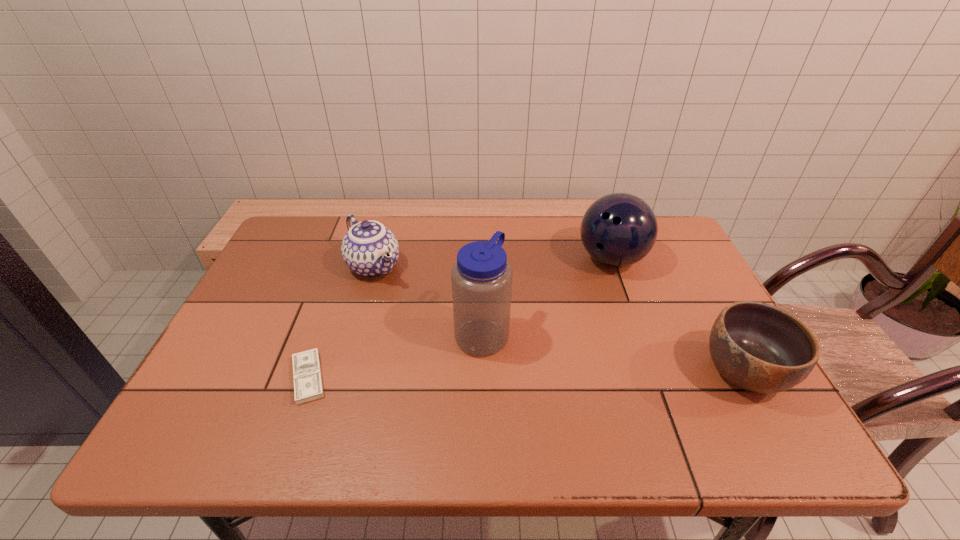
Find the location of a particular element. The width and height of the screenshot is (960, 540). free region at the far left corner of the desktop is located at coordinates (312, 225).

Where is `vacant space at the near right corner of the desktop`? This screenshot has width=960, height=540. vacant space at the near right corner of the desktop is located at coordinates (755, 397).

Identify the location of unoccupied position between the rightmost object and the chinaware. The height and width of the screenshot is (540, 960). (559, 319).

The height and width of the screenshot is (540, 960). What are the coordinates of `vacant area that lies between the money and the water bottle` in the screenshot? It's located at click(x=396, y=356).

The image size is (960, 540). I want to click on empty space that is in between the chinaware and the rightmost object, so click(559, 319).

I want to click on vacant space that is in between the third object from left to right and the bowling ball, so click(x=546, y=296).

Where is `free spot between the water bottle and the money`? The image size is (960, 540). free spot between the water bottle and the money is located at coordinates (396, 356).

Find the location of a particular element. Image resolution: width=960 pixels, height=540 pixels. vacant space in between the fourth object from left to right and the water bottle is located at coordinates (546, 296).

In order to click on vacant space that's between the shortest object and the rightmost object in this screenshot , I will do `click(526, 375)`.

At what (x,y) coordinates should I click in order to perform the action: click on vacant area that lies between the rightmost object and the bowling ball. Please return your answer as a coordinate pair (x, y). Looking at the image, I should click on (678, 315).